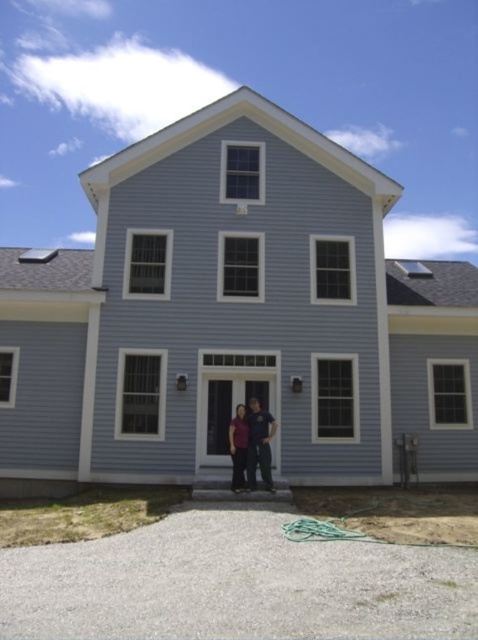
Question: Does matte purple shirt at center have a lesser width compared to black fabric woman at center?

Choices:
 (A) no
 (B) yes

Answer: (A)

Question: Can you confirm if matte purple shirt at center is smaller than black fabric woman at center?

Choices:
 (A) no
 (B) yes

Answer: (A)

Question: Which point appears closest to the camera in this image?

Choices:
 (A) (243, 486)
 (B) (242, 428)

Answer: (A)

Question: Can you confirm if matte purple shirt at center is thinner than black fabric woman at center?

Choices:
 (A) yes
 (B) no

Answer: (B)

Question: Which of the following is the closest to the observer?

Choices:
 (A) pyautogui.click(x=245, y=460)
 (B) pyautogui.click(x=235, y=486)

Answer: (B)